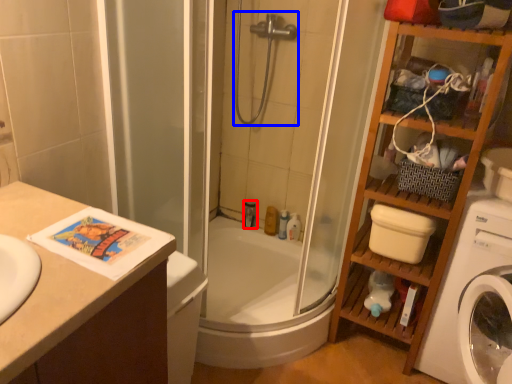
Question: Which object appears farthest to the camera in this image, toiletry (highlighted by a red box) or shower (highlighted by a blue box)?

Choices:
 (A) toiletry
 (B) shower

Answer: (A)